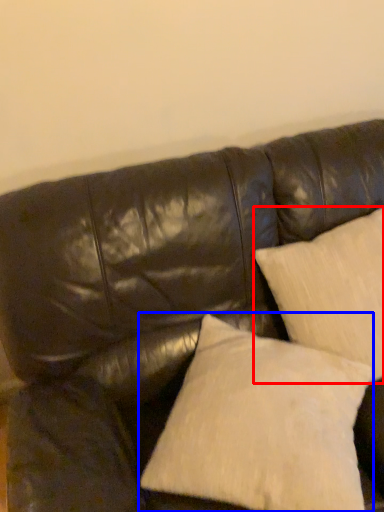
Question: Which object is further to the camera taking this photo, pillow (highlighted by a red box) or pillow (highlighted by a blue box)?

Choices:
 (A) pillow
 (B) pillow

Answer: (A)